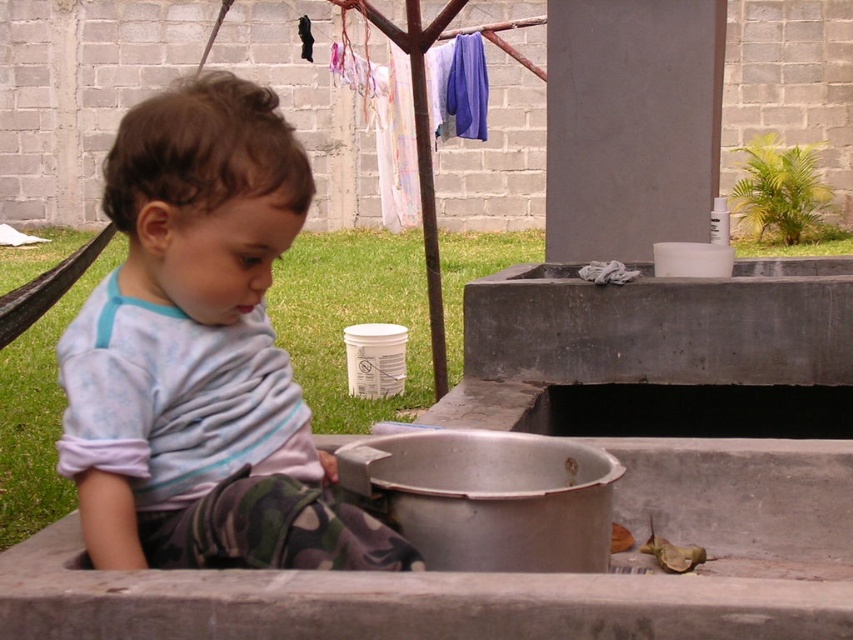
You are standing 10 feet away from the light blue cotton shirt at center. Can you reach it without moving your feet?

The light blue cotton shirt at center is 5.37 feet away from the camera. Since you are standing 10 feet away, you cannot reach it without moving your feet.

You are standing at the position of the child in the image. There are two points marked in the scene. The first point is at coordinates point (283, 179) and the second is at point (373, 460). Which point is closer to you?

Point (283, 179) is in front of point (373, 460), so the first point is closer to you.

You are a photographer trying to capture the scene with the light blue cotton shirt at center and the silver metallic basin at lower center. Based on their positions, which object should you adjust your camera to focus on first if you want to include both in the frame without moving the camera?

The light blue cotton shirt at center is to the left of the silver metallic basin at lower center, so you should focus on the silver metallic basin at lower center first to ensure both are in the frame.